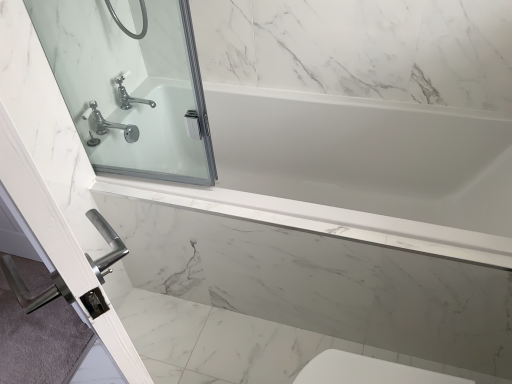
Question: Does clear glass door at upper left come behind white glossy bathtub at center?

Choices:
 (A) no
 (B) yes

Answer: (A)

Question: Is clear glass door at upper left taller than white glossy bathtub at center?

Choices:
 (A) no
 (B) yes

Answer: (B)

Question: Is clear glass door at upper left positioned in front of white glossy bathtub at center?

Choices:
 (A) yes
 (B) no

Answer: (A)

Question: Can you confirm if clear glass door at upper left is thinner than white glossy bathtub at center?

Choices:
 (A) yes
 (B) no

Answer: (A)

Question: From a real-world perspective, is clear glass door at upper left on white glossy bathtub at center?

Choices:
 (A) no
 (B) yes

Answer: (B)

Question: From a real-world perspective, is clear glass door at upper left under white glossy bathtub at center?

Choices:
 (A) no
 (B) yes

Answer: (A)

Question: From the image's perspective, is white glossy bathtub at center located above chrome metallic faucet at upper left?

Choices:
 (A) yes
 (B) no

Answer: (B)

Question: Does white glossy bathtub at center lie behind chrome metallic faucet at upper left?

Choices:
 (A) yes
 (B) no

Answer: (B)

Question: Is the depth of white glossy bathtub at center less than that of chrome metallic faucet at upper left?

Choices:
 (A) yes
 (B) no

Answer: (A)

Question: Is chrome metallic faucet at upper left located within white glossy bathtub at center?

Choices:
 (A) yes
 (B) no

Answer: (B)

Question: From a real-world perspective, does white glossy bathtub at center sit lower than chrome metallic faucet at upper left?

Choices:
 (A) yes
 (B) no

Answer: (A)

Question: Can you confirm if white glossy bathtub at center is smaller than chrome metallic faucet at upper left?

Choices:
 (A) no
 (B) yes

Answer: (A)

Question: Considering the relative sizes of clear glass shower door at upper left and clear glass door at upper left in the image provided, is clear glass shower door at upper left smaller than clear glass door at upper left?

Choices:
 (A) no
 (B) yes

Answer: (B)